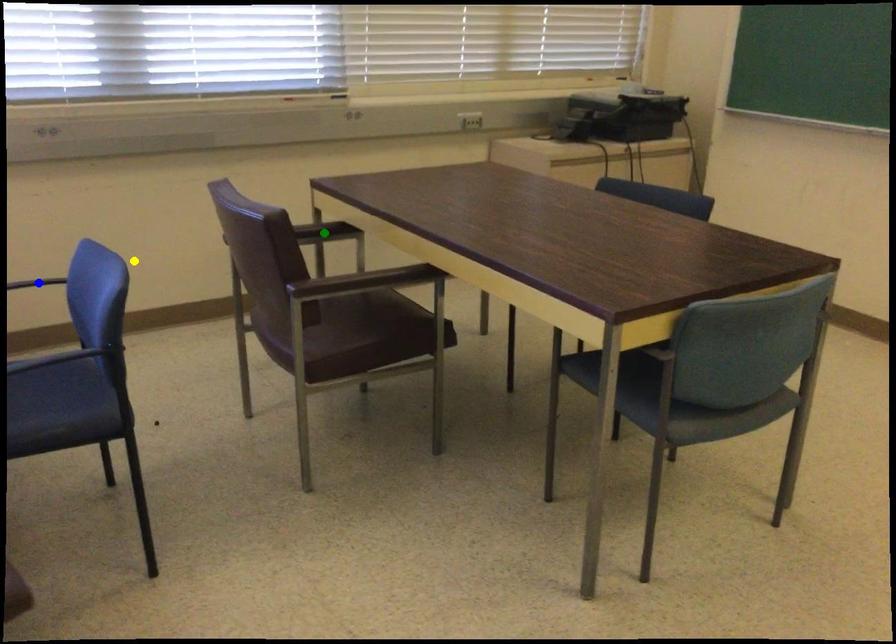
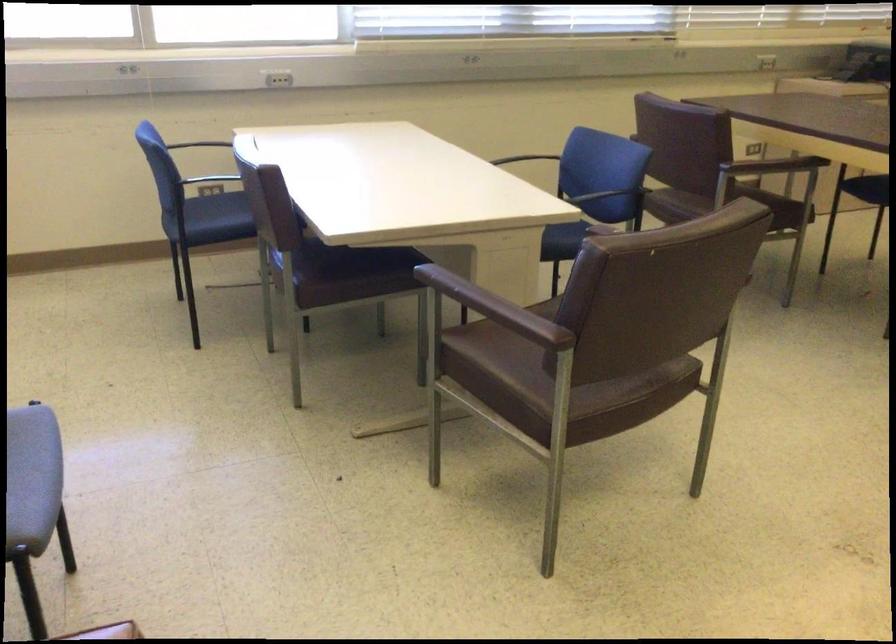
I am providing you with two images of the same scene from different viewpoints. Three points are marked in image1. Which point corresponds to a part or object that is occluded in image2?In image1, three points are marked. Which of them correspond to a part or object that is occluded in image2?Among the three points shown in image1, which one corresponds to a part or object that is no longer visible due to occlusion in image2?

blue point, green point cannot be seen in image2.